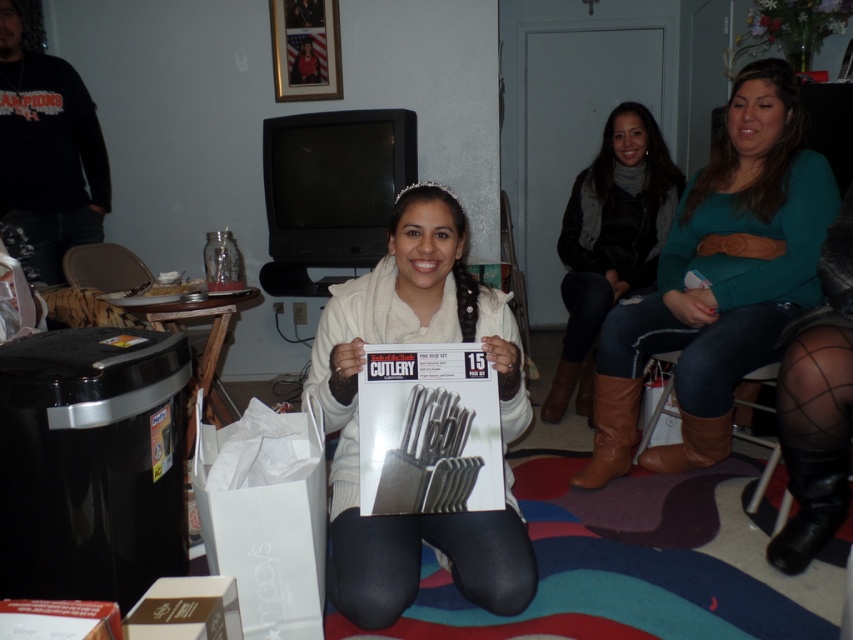
You are a fashion designer observing the image. You need to determine which item is shorter between the white matte sweater at center and the dark brown leather boots at right. Which one is shorter?

The white matte sweater at center is shorter than the dark brown leather boots at right.

You are a delivery person who just arrived at the house. You need to place a package that is 1.5 meters long between the white matte sweater at center and the dark brown leather boots at right. Is there enough space?

The distance between the white matte sweater at center and the dark brown leather boots at right is 1.33 meters. Since the package is 1.5 meters long, it is longer than the available space. Therefore, there is not enough space to place the package between them.

You are standing in the living room and looking at two points marked on the wall. The first point is at coordinate point (701, 332) and the second is at point (785, 529). Which point is closer to you?

Point (701, 332) is further to the camera than point (785, 529), so the second point is closer to you.